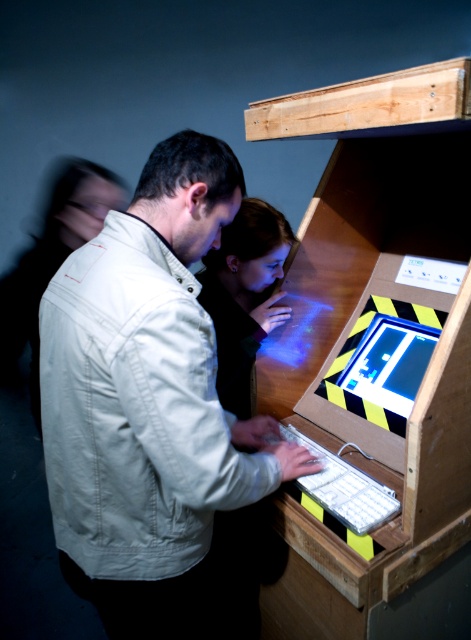
Question: Which point is farther to the camera?

Choices:
 (A) (91, 369)
 (B) (224, 333)

Answer: (B)

Question: Which object is the farthest from the light beige jacket at center?

Choices:
 (A) white matte jacket at center
 (B) white plastic keyboard at lower center

Answer: (A)

Question: Is white matte jacket at center behind light beige jacket at center?

Choices:
 (A) no
 (B) yes

Answer: (A)

Question: Does white matte jacket at center have a greater width compared to white plastic keyboard at lower center?

Choices:
 (A) yes
 (B) no

Answer: (A)

Question: Does white matte jacket at center lie behind light beige jacket at center?

Choices:
 (A) yes
 (B) no

Answer: (B)

Question: Which object is closer to the camera taking this photo?

Choices:
 (A) white matte jacket at center
 (B) white plastic keyboard at lower center

Answer: (A)